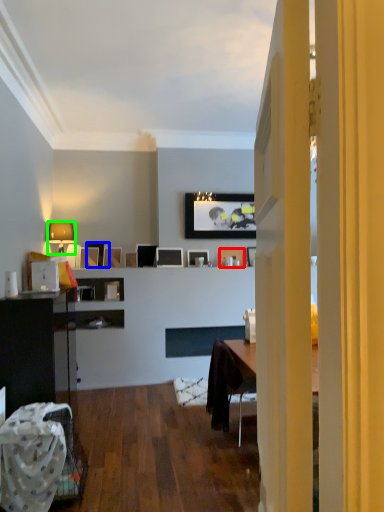
Question: Estimate the real-world distances between objects in this image. Which object is farther from picture frame (highlighted by a red box), picture frame (highlighted by a blue box) or lamp (highlighted by a green box)?

Choices:
 (A) picture frame
 (B) lamp

Answer: (B)